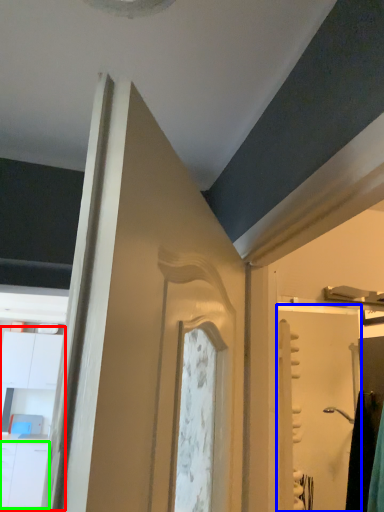
Question: Considering the real-world distances, which object is farthest from dresser (highlighted by a red box)? screen door (highlighted by a blue box) or drawer (highlighted by a green box)?

Choices:
 (A) screen door
 (B) drawer

Answer: (A)